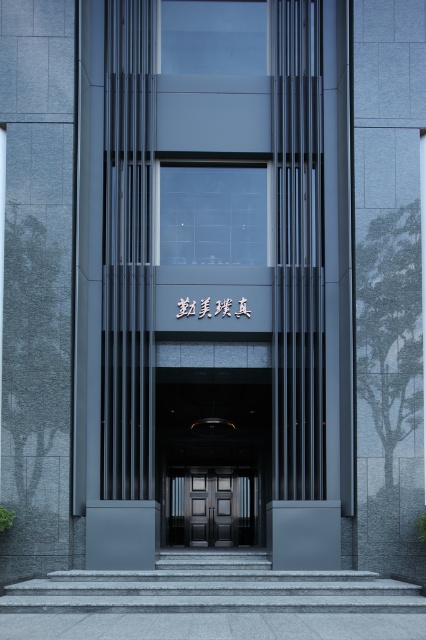
Does matte glass entrance at center appear on the right side of polished dark wood doors at center?

No, matte glass entrance at center is not to the right of polished dark wood doors at center.

Is matte glass entrance at center positioned before polished dark wood doors at center?

Yes, it is in front of polished dark wood doors at center.

Is point (284, 288) behind point (218, 483)?

No, (284, 288) is closer to viewer.

Find the location of `matte glass entrance at center`. matte glass entrance at center is located at coordinates (213, 259).

Between point (310, 563) and point (114, 593), which one is positioned in front?

Positioned in front is point (114, 593).

Measure the distance between point (351, 252) and camera.

Point (351, 252) and camera are 14.51 meters apart.

Where is `matte glass entrance at center`? matte glass entrance at center is located at coordinates (213, 259).

Between gray concrete stairs at center and polished dark wood doors at center, which one has more height?

polished dark wood doors at center is taller.

Which is below, gray concrete stairs at center or polished dark wood doors at center?

polished dark wood doors at center

Is point (29, 605) positioned behind point (167, 493)?

No, (29, 605) is in front of (167, 493).

The width and height of the screenshot is (426, 640). I want to click on gray concrete stairs at center, so click(212, 588).